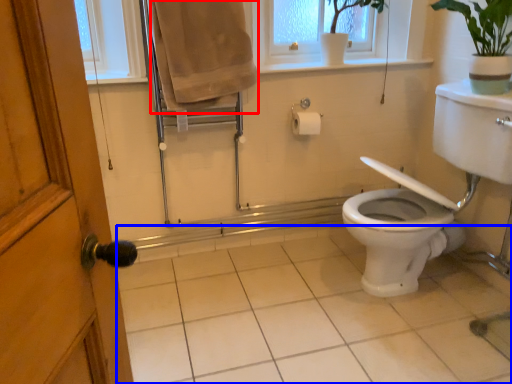
Question: Which point is further to the camera, bath towel (highlighted by a red box) or plain (highlighted by a blue box)?

Choices:
 (A) bath towel
 (B) plain

Answer: (A)